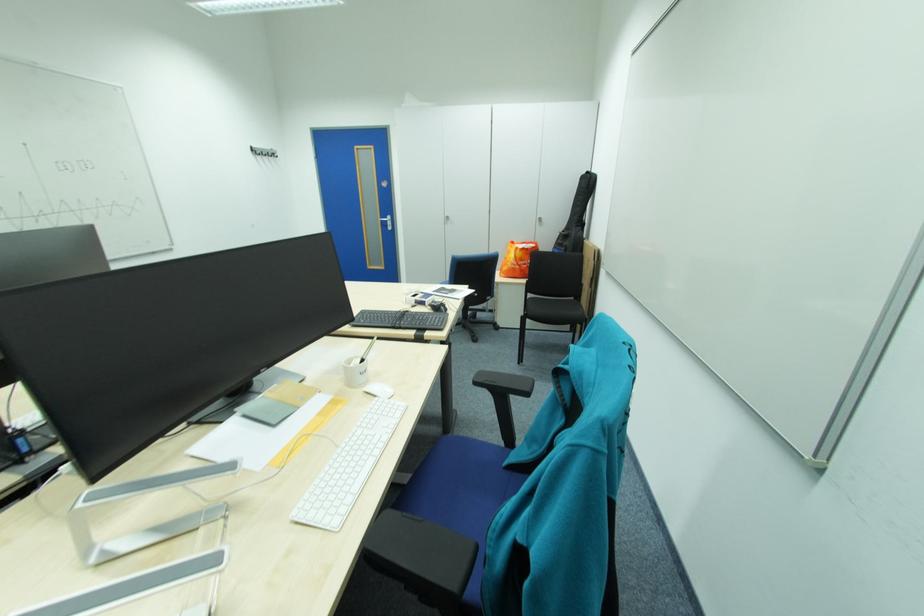
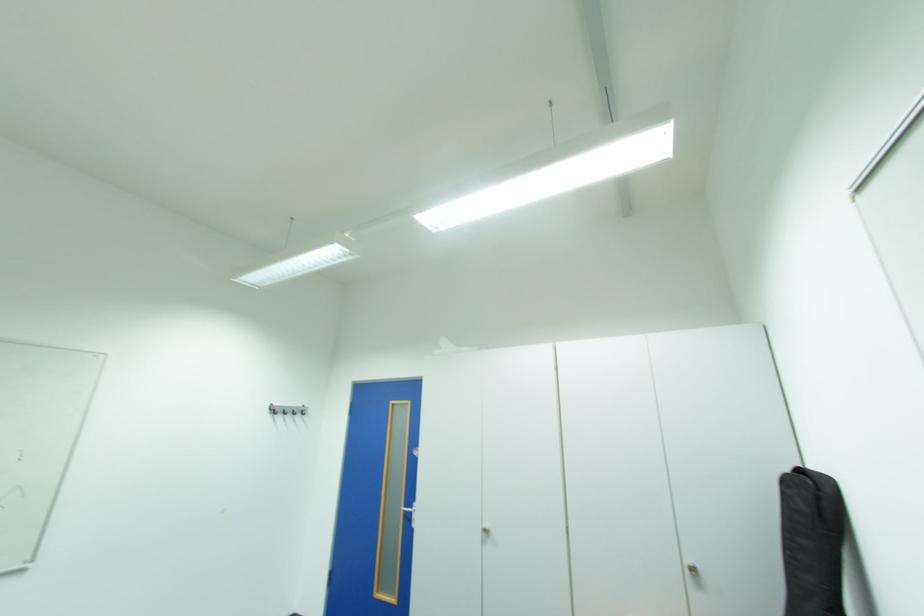
In the second image, find the point that corresponds to pixel 390 221 in the first image.

(414, 511)